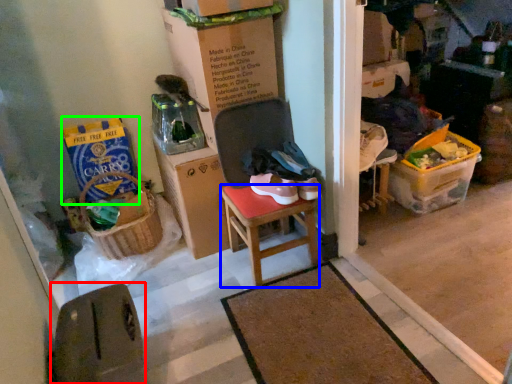
Question: Which is farther away from chair (highlighted by a red box)? stool (highlighted by a blue box) or box (highlighted by a green box)?

Choices:
 (A) stool
 (B) box

Answer: (B)